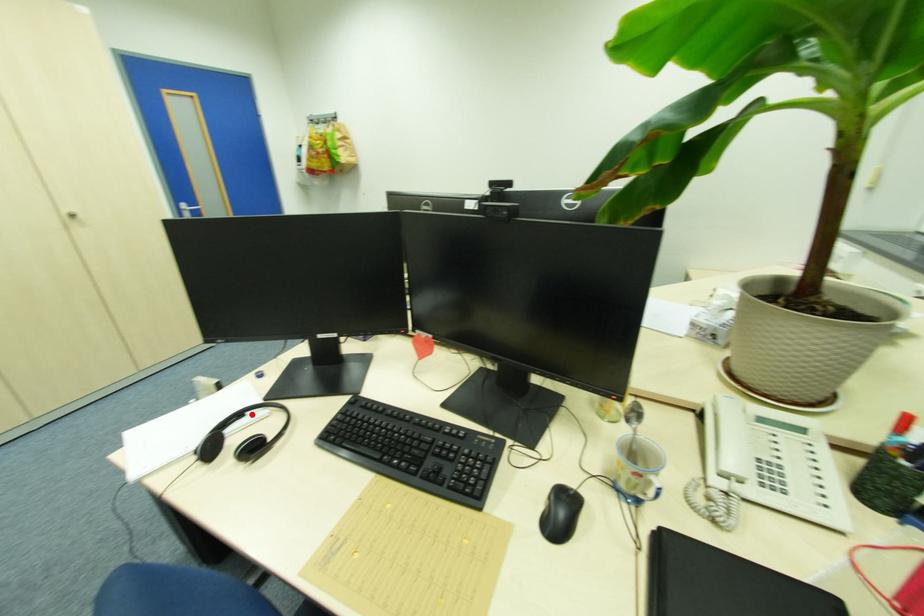
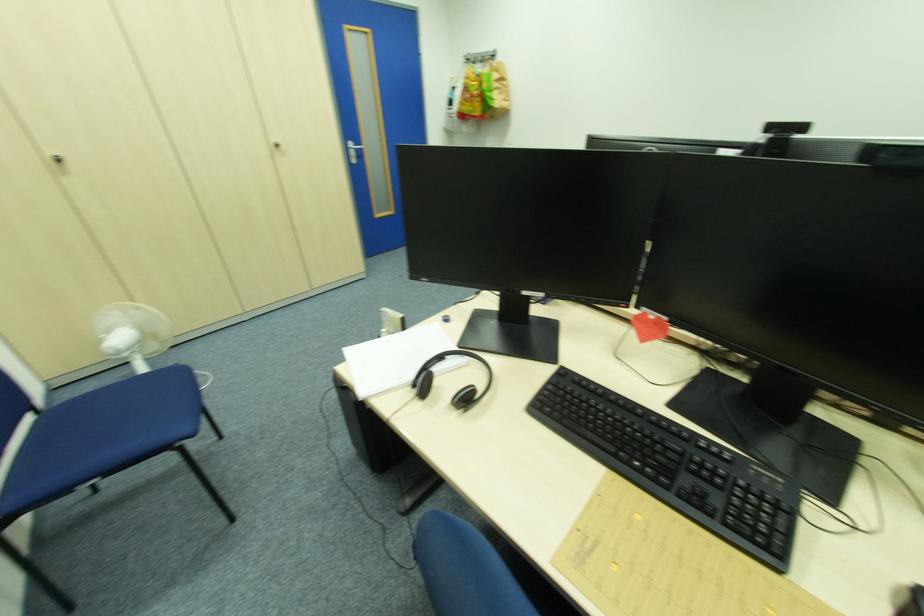
Where in the second image is the point corresponding to the highlighted location from the first image?

(454, 359)